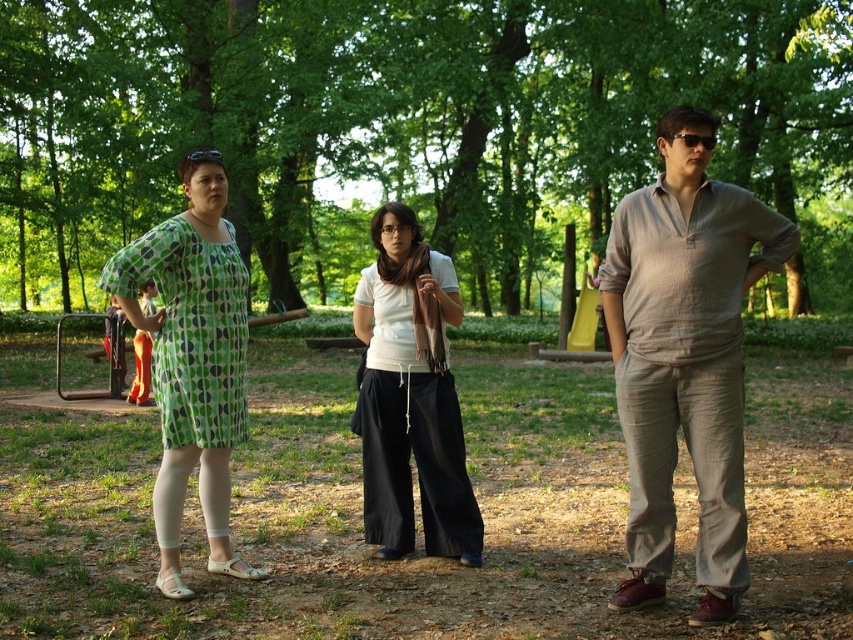
Between green leafy tree at center and light brown linen shirt at right, which one has more height?

Standing taller between the two is green leafy tree at center.

Consider the image. Between green leafy tree at center and light brown linen shirt at right, which one is positioned lower?

light brown linen shirt at right is below.

Between point (120, 52) and point (616, 214), which one is positioned in front?

Point (616, 214)

The image size is (853, 640). What are the coordinates of `green leafy tree at center` in the screenshot? It's located at (398, 115).

Which is above, green leafy tree at center or green dotted dress at left?

green leafy tree at center is higher up.

The height and width of the screenshot is (640, 853). What are the coordinates of `green leafy tree at center` in the screenshot? It's located at (398, 115).

Is light brown linen shirt at right thinner than green dotted dress at left?

Incorrect, light brown linen shirt at right's width is not less than green dotted dress at left's.

Does point (660, 412) come in front of point (190, 436)?

Yes, point (660, 412) is in front of point (190, 436).

Identify the location of light brown linen shirt at right. coord(685,356).